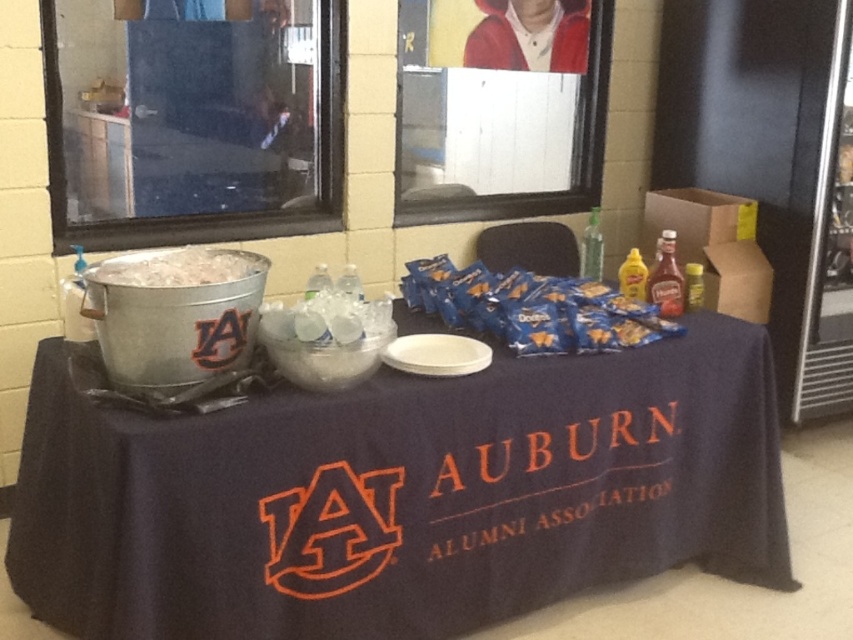
Question: Is the position of blue matte doritos at center more distant than that of white frosted ice at left?

Choices:
 (A) no
 (B) yes

Answer: (B)

Question: Among these objects, which one is nearest to the camera?

Choices:
 (A) dark blue fabric at center
 (B) blue matte doritos at center
 (C) white frosted ice at left

Answer: (A)

Question: Is blue matte doritos at center positioned before white frosted ice at left?

Choices:
 (A) no
 (B) yes

Answer: (A)

Question: Which point is closer to the camera?

Choices:
 (A) dark blue fabric at center
 (B) white frosted ice at left
 (C) blue matte doritos at center

Answer: (A)

Question: Does blue matte doritos at center appear on the right side of white frosted ice at left?

Choices:
 (A) yes
 (B) no

Answer: (A)

Question: Which object is closer to the camera taking this photo?

Choices:
 (A) blue matte doritos at center
 (B) dark blue fabric at center
 (C) white frosted ice at left

Answer: (B)